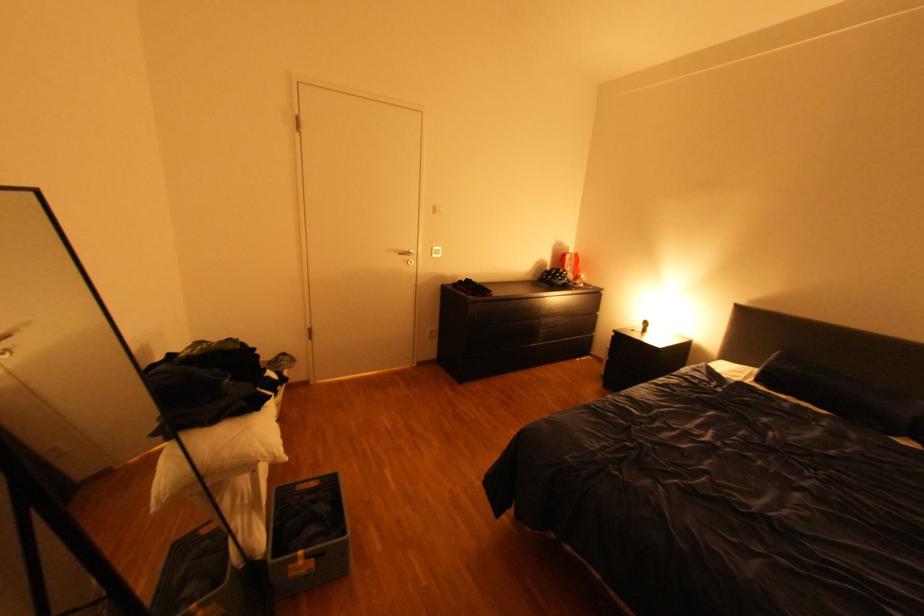
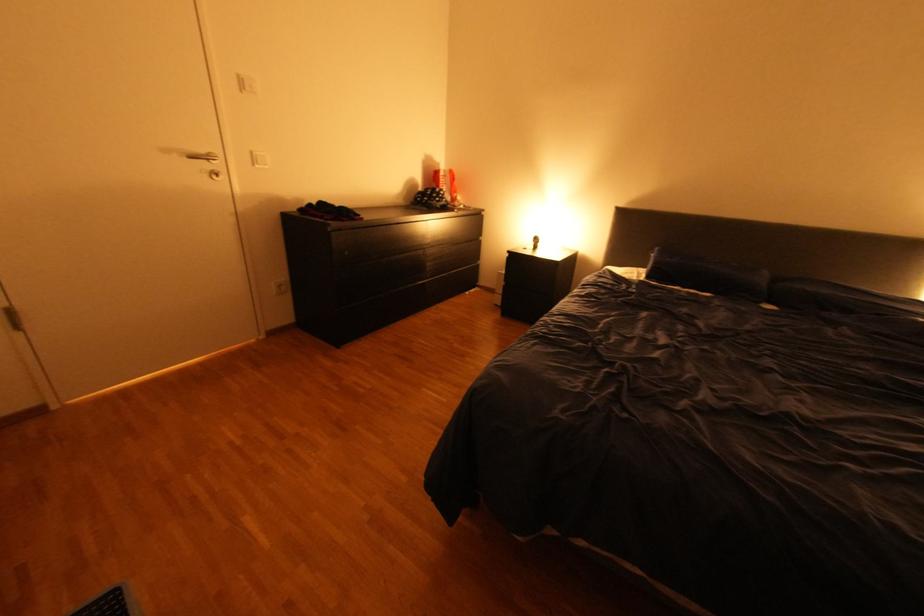
The point at (576, 276) is marked in the first image. Where is the corresponding point in the second image?

(454, 196)